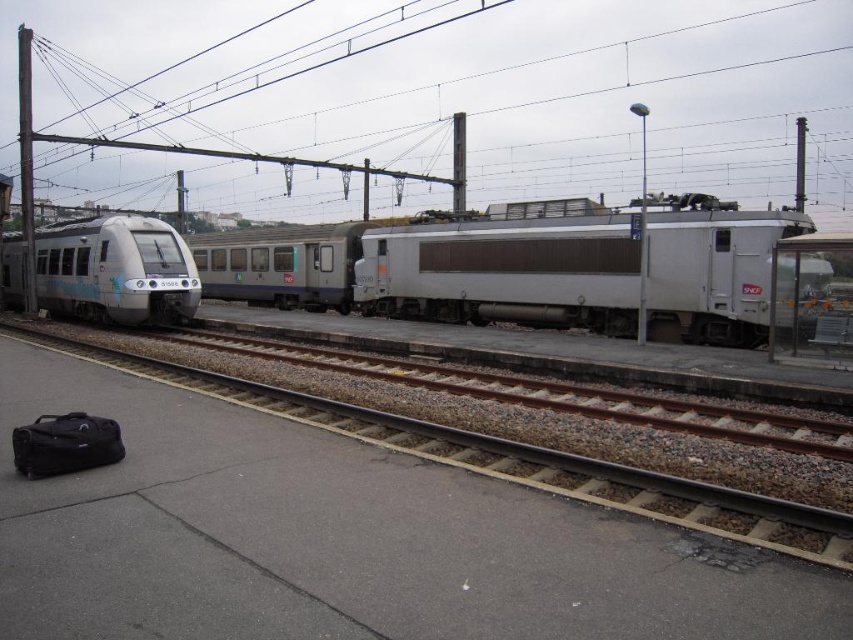
Does gray gravel train track at center have a lesser width compared to black fabric bag at lower left?

Incorrect, gray gravel train track at center's width is not less than black fabric bag at lower left's.

Does point (775, 524) lie behind point (73, 468)?

No, (775, 524) is in front of (73, 468).

Where is `gray gravel train track at center`? gray gravel train track at center is located at coordinates (506, 458).

Does silver metallic train at center appear on the right side of black fabric bag at lower left?

Correct, you'll find silver metallic train at center to the right of black fabric bag at lower left.

The image size is (853, 640). I want to click on silver metallic train at center, so click(442, 266).

Who is more forward, (836, 556) or (119, 253)?

Point (836, 556) is in front.

Does gray gravel train track at center have a smaller size compared to silver metallic train at left?

Yes.

Does point (780, 547) come in front of point (144, 289)?

That is True.

The height and width of the screenshot is (640, 853). In order to click on gray gravel train track at center in this screenshot , I will do [506, 458].